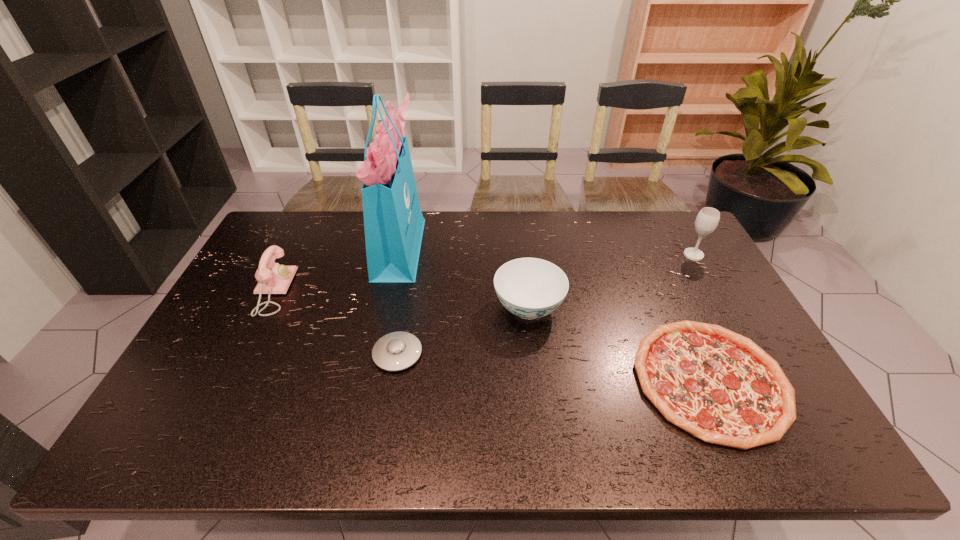
Identify the location of free space between the saucer and the leftmost object. (335, 322).

Image resolution: width=960 pixels, height=540 pixels. In order to click on vacant area that lies between the shortest object and the wineglass in this screenshot , I will do `click(702, 318)`.

Identify the location of blank region between the fourth object from left to right and the telephone. Image resolution: width=960 pixels, height=540 pixels. (400, 299).

Find the location of a particular element. Image resolution: width=960 pixels, height=540 pixels. the fifth closest object to the fifth tallest object is located at coordinates [708, 218].

Select which object is the third closest to the chinaware. Please provide its 2D coordinates. Your answer should be formatted as a tuple, i.e. [(x, y)], where the tuple contains the x and y coordinates of a point satisfying the conditions above.

[(393, 221)]

Where is `free location that satisfies the following two spatial constraints: 1. on the front side of the shortest object; 2. on the left side of the fourth object from left to right`? The height and width of the screenshot is (540, 960). free location that satisfies the following two spatial constraints: 1. on the front side of the shortest object; 2. on the left side of the fourth object from left to right is located at coordinates (537, 380).

This screenshot has height=540, width=960. I want to click on free location that satisfies the following two spatial constraints: 1. on the dial of the shortest object; 2. on the right side of the telephone, so click(x=228, y=380).

You are a GUI agent. You are given a task and a screenshot of the screen. Output one action in this format:
    pyautogui.click(x=<x>, y=<y>)
    Task: Click on the vacant space that satisfies the following two spatial constraints: 1. on the dial of the leftmost object; 2. on the left side of the third object from right to left
    The height and width of the screenshot is (540, 960).
    Given the screenshot: What is the action you would take?
    pyautogui.click(x=264, y=308)

Locate an element on the screen. Image resolution: width=960 pixels, height=540 pixels. free point that satisfies the following two spatial constraints: 1. on the dial of the pizza; 2. on the right side of the leftmost object is located at coordinates [228, 380].

Where is `vacant region that satisfies the following two spatial constraints: 1. on the front side of the tallest object; 2. on the dial of the telephone`? vacant region that satisfies the following two spatial constraints: 1. on the front side of the tallest object; 2. on the dial of the telephone is located at coordinates (390, 291).